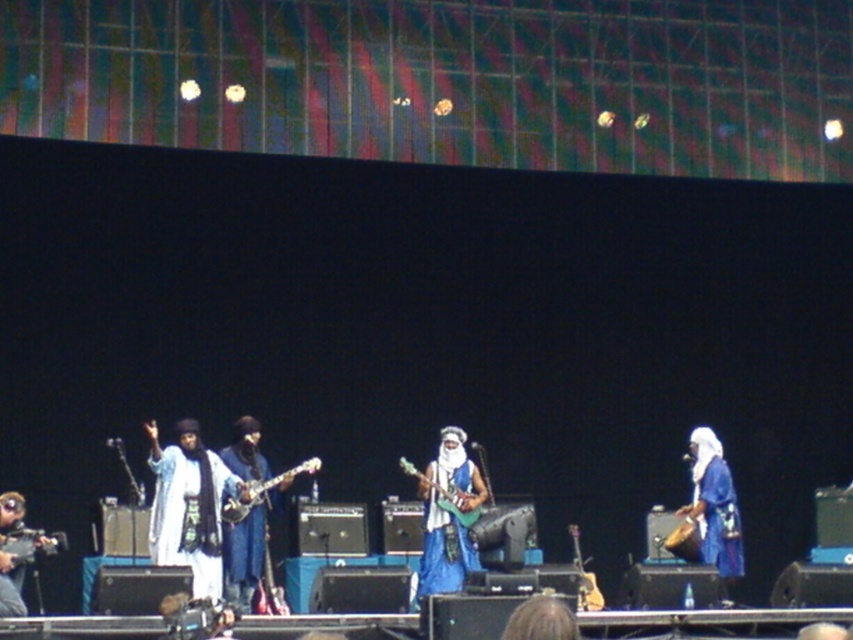
The width and height of the screenshot is (853, 640). What do you see at coordinates (541, 620) in the screenshot?
I see `dark blue fabric headscarf at center` at bounding box center [541, 620].

Is dark blue fabric headscarf at center to the left of wooden drum at center from the viewer's perspective?

Correct, you'll find dark blue fabric headscarf at center to the left of wooden drum at center.

Does point (564, 630) come behind point (685, 506)?

No, (564, 630) is in front of (685, 506).

Where is `dark blue fabric headscarf at center`? dark blue fabric headscarf at center is located at coordinates (541, 620).

Does blue fabric at center have a smaller size compared to green matte electric guitar at center?

No, blue fabric at center is not smaller than green matte electric guitar at center.

Does blue fabric at center appear on the right side of green matte electric guitar at center?

Correct, you'll find blue fabric at center to the right of green matte electric guitar at center.

Image resolution: width=853 pixels, height=640 pixels. I want to click on blue fabric at center, so click(x=714, y=509).

Between white matte clothing at center and blue fabric guitar at center, which one is positioned higher?

blue fabric guitar at center is higher up.

Is point (231, 492) behind point (453, 518)?

No, (231, 492) is closer to viewer.

The image size is (853, 640). I want to click on white matte clothing at center, so click(x=189, y=506).